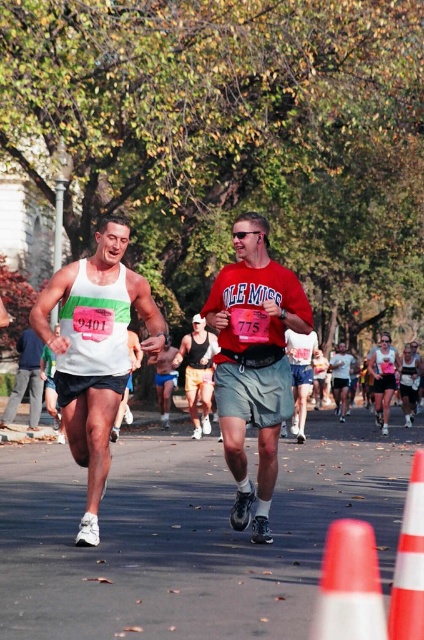
Does red matte shirt at center appear on the left side of orange plastic traffic cone at lower right?

Correct, you'll find red matte shirt at center to the left of orange plastic traffic cone at lower right.

Who is positioned more to the right, red matte shirt at center or orange plastic traffic cone at lower right?

orange plastic traffic cone at lower right

What are the coordinates of `red matte shirt at center` in the screenshot? It's located at (253, 362).

Image resolution: width=424 pixels, height=640 pixels. Identify the location of red matte shirt at center. tap(253, 362).

In the scene shown: Which of these two, white plastic traffic cone at lower right or orange plastic traffic cone at lower right, stands shorter?

orange plastic traffic cone at lower right is shorter.

Who is more forward, (379,577) or (406,624)?

Point (406,624) is in front.

Identify the location of white plastic traffic cone at lower right. (348, 586).

Between point (379, 582) and point (282, 435), which one is positioned in front?

Point (379, 582) is more forward.

Between white plastic traffic cone at lower right and matte red shirt at center, which one appears on the right side from the viewer's perspective?

Positioned to the right is matte red shirt at center.

Does point (345, 602) come farther from viewer compared to point (292, 358)?

That is False.

Find the location of a particular element. The width and height of the screenshot is (424, 640). white plastic traffic cone at lower right is located at coordinates (348, 586).